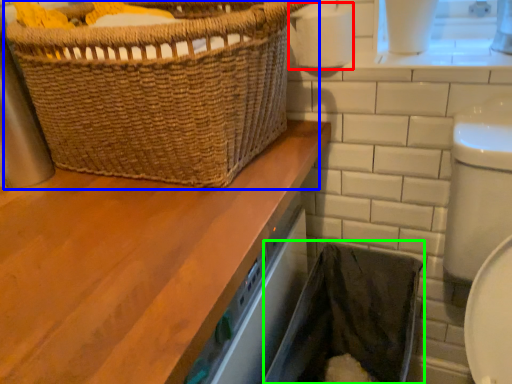
Question: Based on their relative distances, which object is farther from toilet paper (highlighted by a red box)? Choose from picnic basket (highlighted by a blue box) and laundry basket (highlighted by a green box).

Choices:
 (A) picnic basket
 (B) laundry basket

Answer: (B)